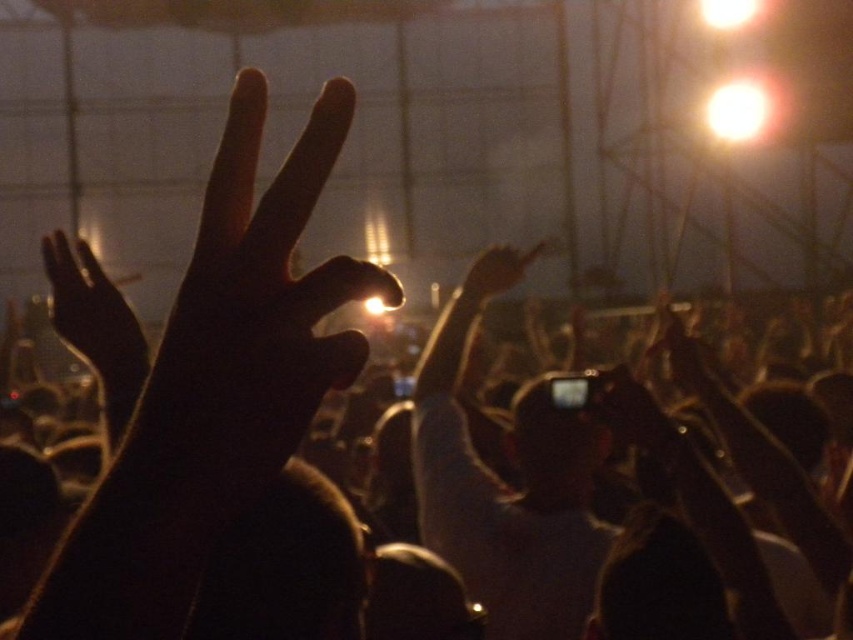
Which is more to the left, black matte hand at center or matte black hand at upper center?

From the viewer's perspective, black matte hand at center appears more on the left side.

Is black matte hand at center closer to camera compared to matte black hand at upper center?

Yes.

Is point (51, 625) more distant than point (498, 276)?

No, it is not.

The height and width of the screenshot is (640, 853). In order to click on black matte hand at center in this screenshot , I will do `click(215, 387)`.

Is the position of black matte hand at upper left less distant than that of matte black hand at upper center?

Yes, it is in front of matte black hand at upper center.

Can you confirm if black matte hand at upper left is taller than matte black hand at upper center?

Yes.

Is point (48, 241) behind point (491, 276)?

No, it is in front of (491, 276).

Where is `black matte hand at upper left`? This screenshot has width=853, height=640. black matte hand at upper left is located at coordinates (93, 316).

Can you confirm if black matte hand at center is positioned to the left of black matte hand at upper left?

In fact, black matte hand at center is to the right of black matte hand at upper left.

Does point (189, 461) lie in front of point (132, 342)?

Yes.

At what (x,y) coordinates should I click in order to perform the action: click on black matte hand at center. Please return your answer as a coordinate pair (x, y). Looking at the image, I should click on (215, 387).

Locate an element on the screen. This screenshot has height=640, width=853. black matte hand at center is located at coordinates (215, 387).